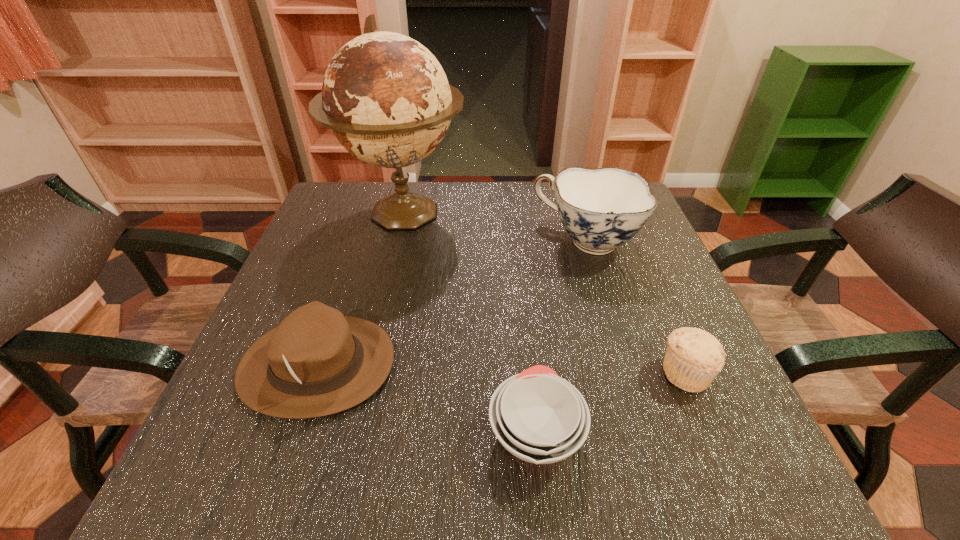
Identify the location of vacant space at the near edge. (649, 466).

The height and width of the screenshot is (540, 960). I want to click on vacant space at the left edge of the desktop, so click(x=313, y=256).

Where is `free space at the right edge of the desktop`? This screenshot has width=960, height=540. free space at the right edge of the desktop is located at coordinates (642, 333).

This screenshot has height=540, width=960. Find the location of `vacant space at the far left corner of the desktop`. vacant space at the far left corner of the desktop is located at coordinates (337, 222).

In the image, there is a desktop. Where is `vacant area at the near left corner`? The height and width of the screenshot is (540, 960). vacant area at the near left corner is located at coordinates (270, 467).

You are a GUI agent. You are given a task and a screenshot of the screen. Output one action in this format:
    pyautogui.click(x=<x>, y=<y>)
    Task: Click on the vacant region at the near right corner
    
    Given the screenshot: What is the action you would take?
    pyautogui.click(x=755, y=467)

At what (x,y) coordinates should I click in order to perform the action: click on free space between the soup bowl and the muffin. Please return your answer as a coordinate pair (x, y). Image resolution: width=960 pixels, height=540 pixels. Looking at the image, I should click on (x=611, y=402).

Identify the location of free space between the fourth tallest object and the tallest object. The width and height of the screenshot is (960, 540). (544, 293).

The image size is (960, 540). I want to click on blank region between the fedora and the chinaware, so click(x=452, y=303).

The width and height of the screenshot is (960, 540). In order to click on empty location between the tallest object and the second tallest object in this screenshot , I will do `click(494, 227)`.